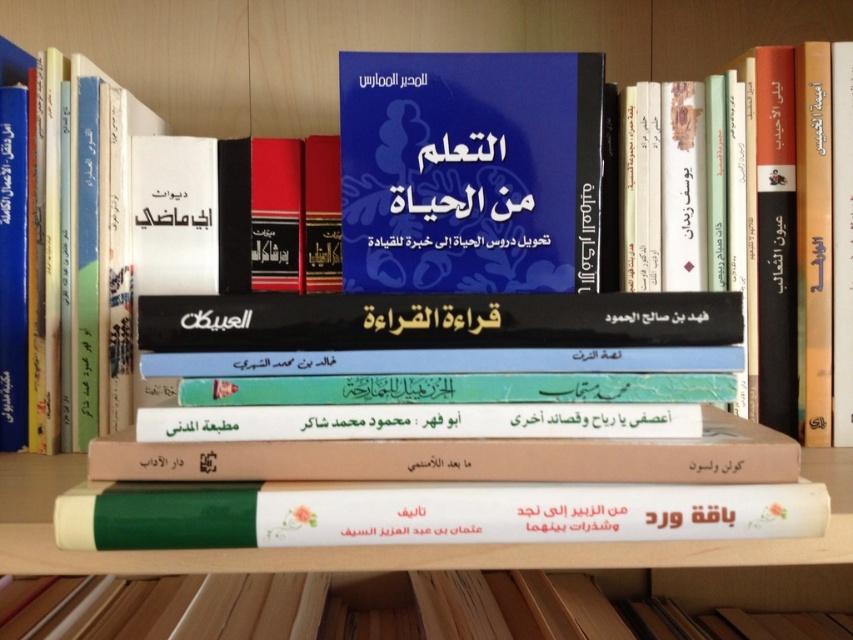
Is point (509, 145) positioned after point (331, 538)?

Yes.

At what (x,y) coordinates should I click in order to perform the action: click on blue matte book at center. Please return your answer as a coordinate pair (x, y). Image resolution: width=853 pixels, height=640 pixels. Looking at the image, I should click on (469, 170).

Where is `blue matte book at center`? The height and width of the screenshot is (640, 853). blue matte book at center is located at coordinates (469, 170).

Does blue matte book at center appear under green matte book at center?

Incorrect, blue matte book at center is not positioned below green matte book at center.

Where is `blue matte book at center`? This screenshot has width=853, height=640. blue matte book at center is located at coordinates (469, 170).

What are the coordinates of `blue matte book at center` in the screenshot? It's located at (469, 170).

Is green matte book at center positioned behind white paper book at center?

Yes.

Between green matte book at center and white paper book at center, which one is positioned lower?

green matte book at center is lower down.

Does point (39, 602) lie behind point (758, 484)?

Yes, point (39, 602) is behind point (758, 484).

Where is `green matte book at center`? green matte book at center is located at coordinates (380, 609).